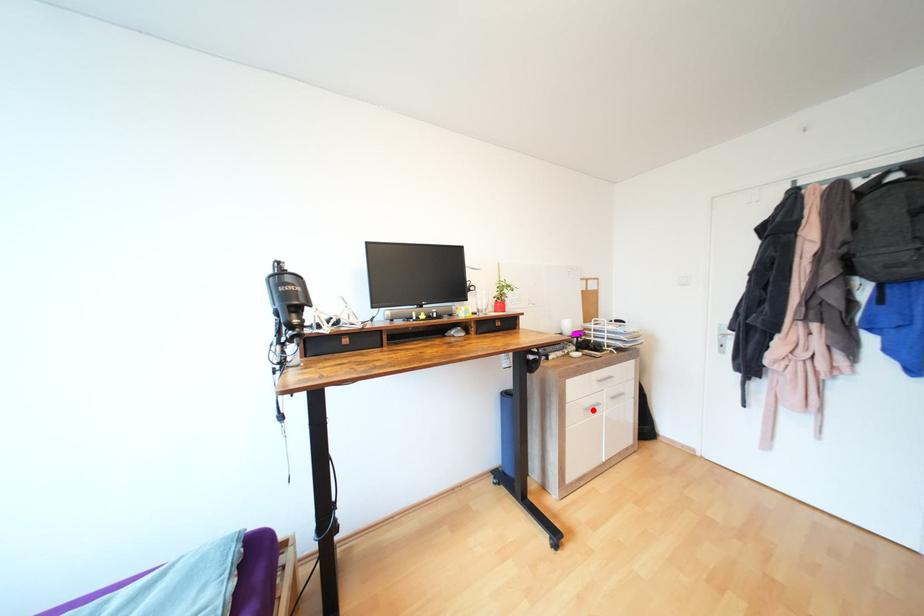
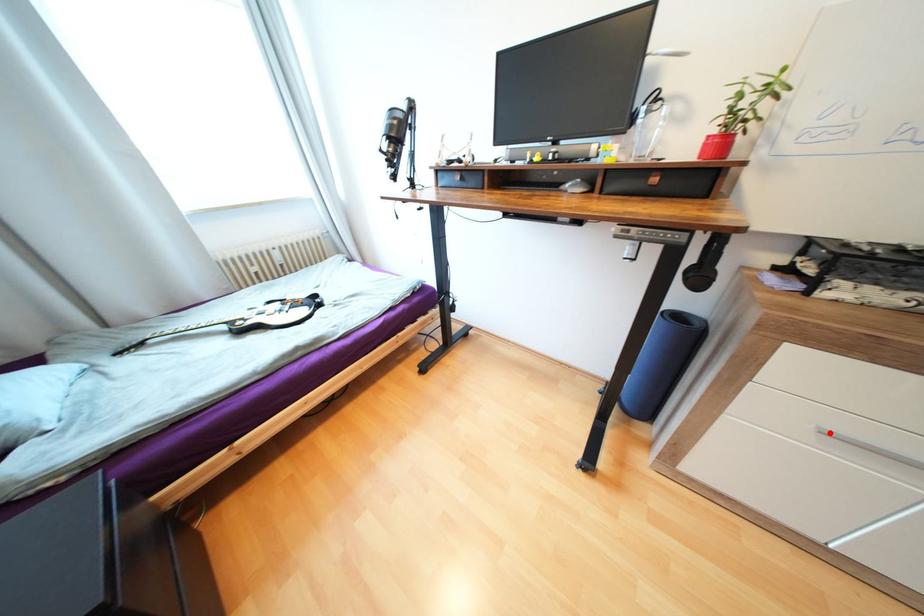
I am providing you with two images of the same scene from different viewpoints. A red point is marked on the first image and another point is marked on the second image. Are the points marked in image1 and image2 representing the same 3D position?

Yes